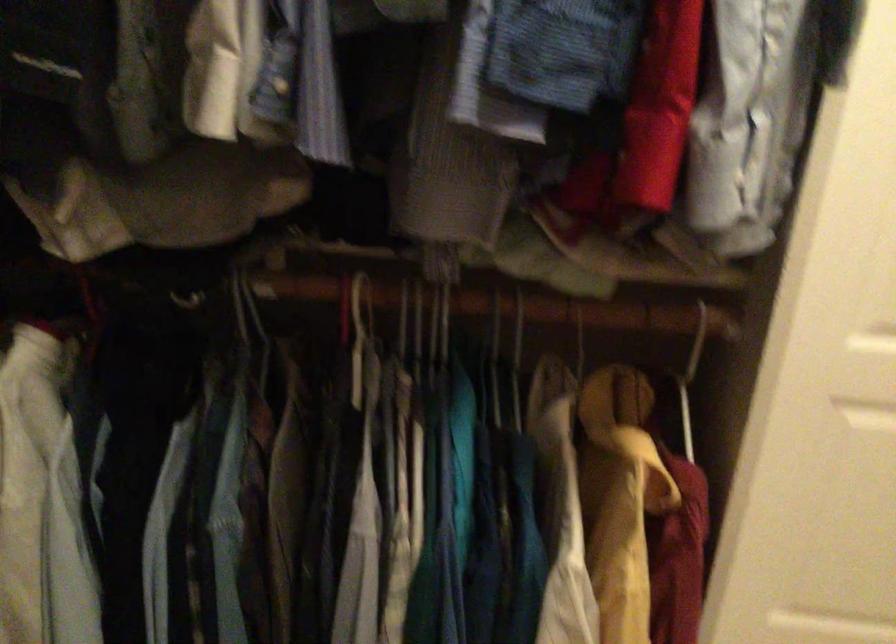
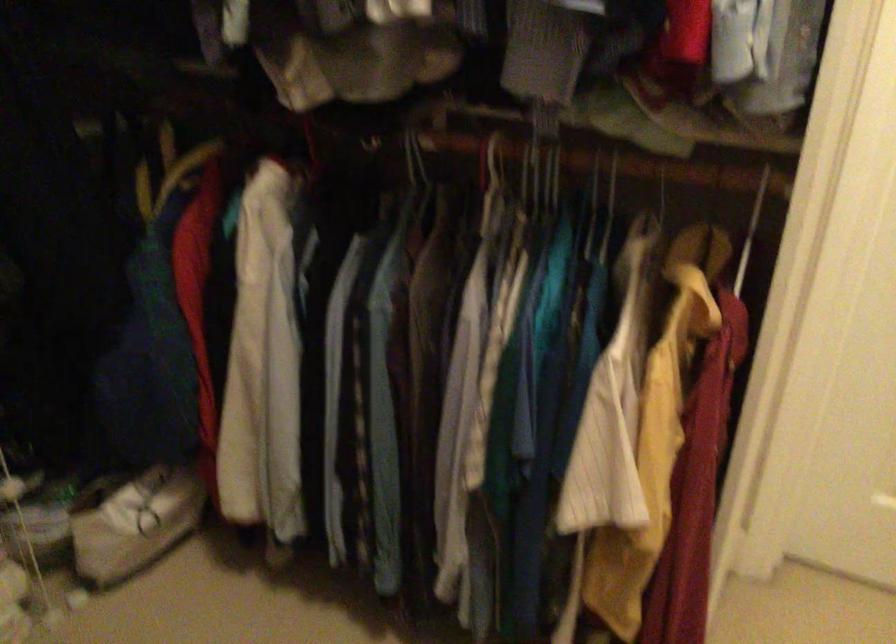
Locate, in the second image, the point that corresponds to point (476, 341) in the first image.

(609, 210)